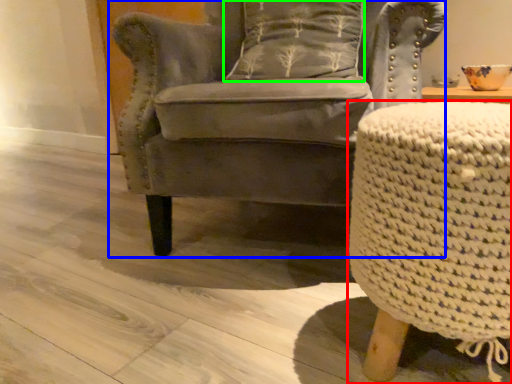
Question: Which is farther away from table (highlighted by a red box)? chair (highlighted by a blue box) or pillow (highlighted by a green box)?

Choices:
 (A) chair
 (B) pillow

Answer: (B)